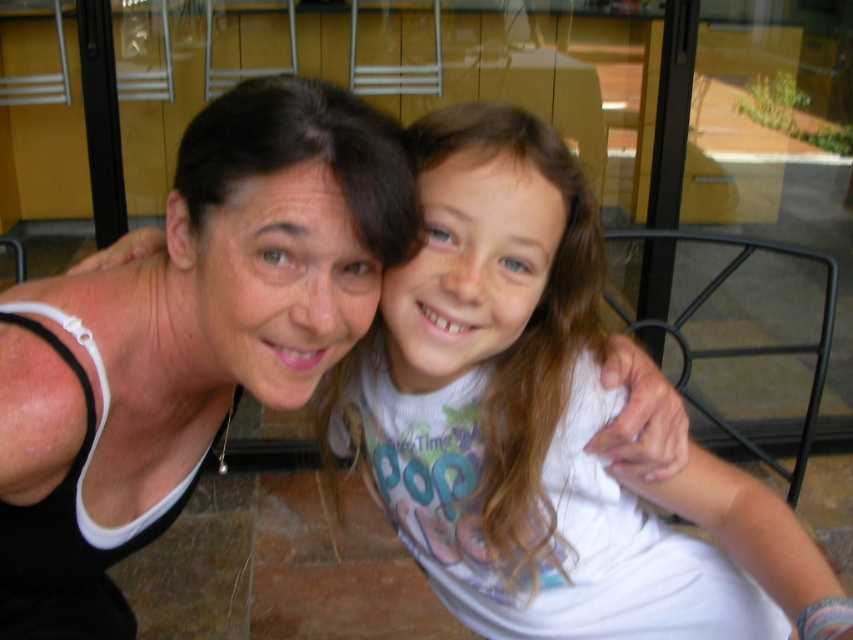
Question: Does white cotton shirt at center appear under matte black tank top at upper left?

Choices:
 (A) no
 (B) yes

Answer: (B)

Question: Which object is closer to the camera taking this photo?

Choices:
 (A) matte black tank top at upper left
 (B) white cotton shirt at center

Answer: (A)

Question: Among these points, which one is farthest from the camera?

Choices:
 (A) (102, 461)
 (B) (527, 516)

Answer: (B)

Question: Is white cotton shirt at center wider than matte black tank top at upper left?

Choices:
 (A) yes
 (B) no

Answer: (A)

Question: Is white cotton shirt at center closer to the viewer compared to matte black tank top at upper left?

Choices:
 (A) yes
 (B) no

Answer: (B)